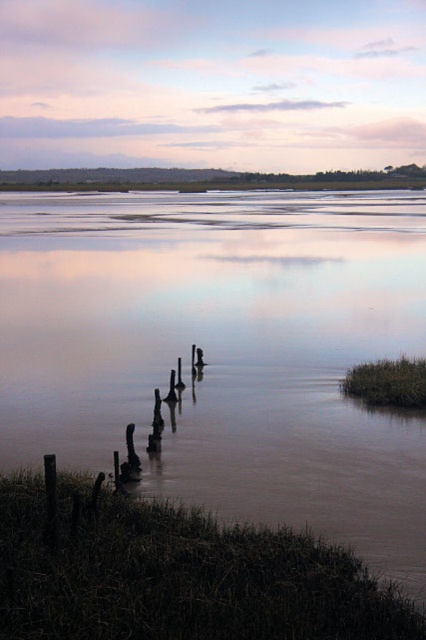
You are a photographer planning to capture the reflection of the sky in the brown muddy water at lower left. Based on the scene description, where should you position your camera to ensure the reflection is clearly visible?

To capture the reflection of the sky in the brown muddy water at lower left, position your camera at the same height as the water surface and directly above it. This ensures the reflection is clearly visible.

You are standing at the edge of the water and want to cross to the other side. You see the brown muddy water at lower left and the dark brown wood posts at lower left. Which path should you choose to avoid getting your shoes wet?

You should choose the dark brown wood posts at lower left because they are narrower than the brown muddy water at lower left, so stepping on them would keep your shoes drier.

You are standing on the grassy bank and want to cross to the wooden posts. The brown muddy water at lower left and dark brown wood posts at lower left are in your path. Which object is taller, making it harder to step over?

The brown muddy water at lower left has a greater height compared to the dark brown wood posts at lower left, so the muddy water is taller and harder to step over.